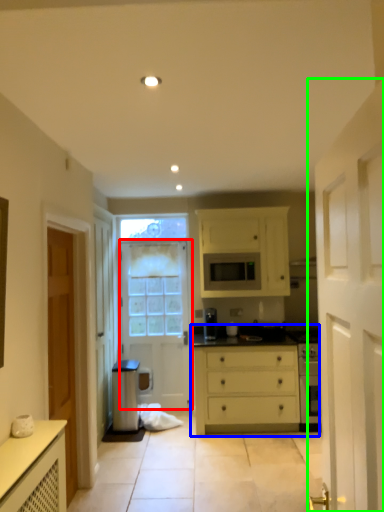
Question: Which is nearer to the door (highlighted by a red box)? chest of drawers (highlighted by a blue box) or door (highlighted by a green box).

Choices:
 (A) chest of drawers
 (B) door

Answer: (A)